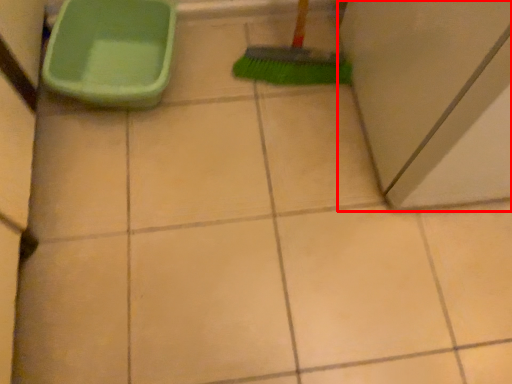
Question: From the image's perspective, considering the relative positions of screen door (annotated by the red box) and toilet in the image provided, where is screen door (annotated by the red box) located with respect to the staircase?

Choices:
 (A) above
 (B) below

Answer: (A)